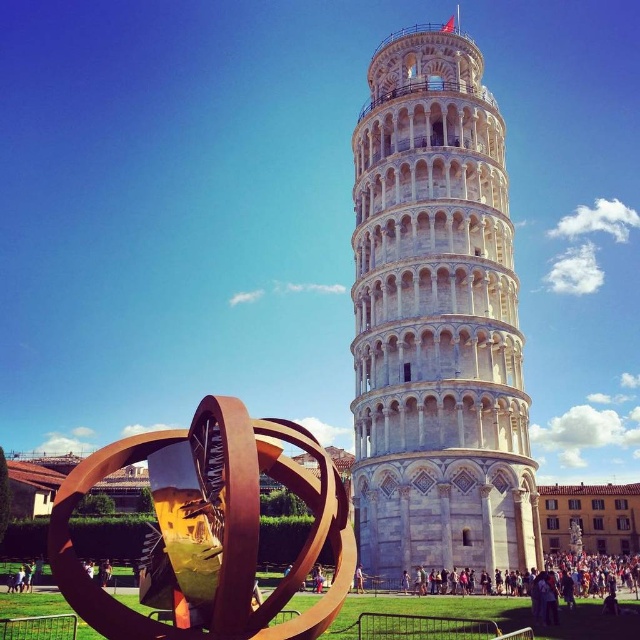
In the scene shown: Is the position of white stone tower at center less distant than that of rusty metal sphere at lower left?

No, it is behind rusty metal sphere at lower left.

Is white stone tower at center bigger than rusty metal sphere at lower left?

Correct, white stone tower at center is larger in size than rusty metal sphere at lower left.

At what (x,y) coordinates should I click in order to perform the action: click on white stone tower at center. Please return your answer as a coordinate pair (x, y). This screenshot has height=640, width=640. Looking at the image, I should click on tap(436, 321).